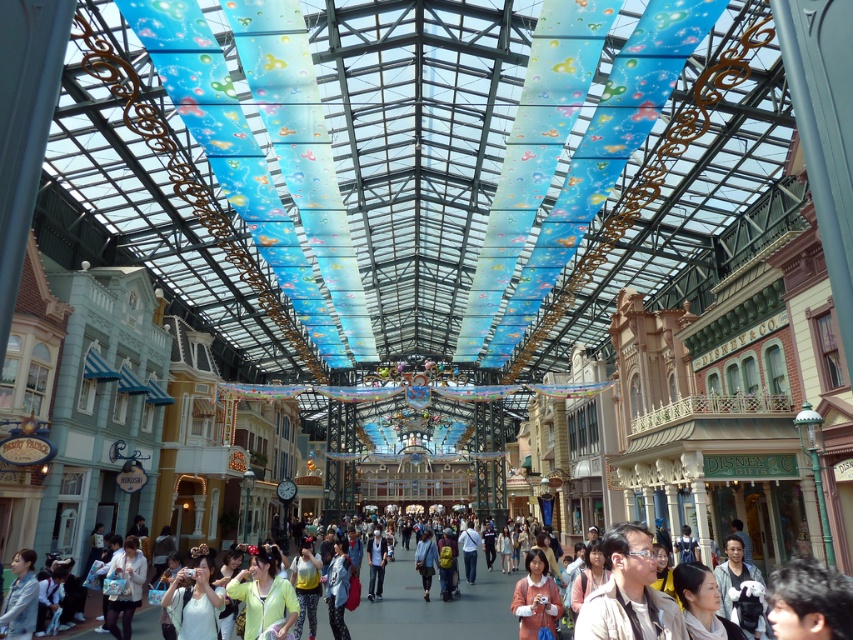
Question: Can you confirm if light green fabric at center is smaller than matte purple shirt at lower right?

Choices:
 (A) yes
 (B) no

Answer: (B)

Question: Which of the following is the closest to the observer?

Choices:
 (A) light green fabric at center
 (B) light brown leather jacket at lower right

Answer: (A)

Question: Which of these objects is positioned closest to the light green fabric at center?

Choices:
 (A) light blue denim jeans at center
 (B) matte purple shirt at lower right
 (C) denim jacket at lower left

Answer: (A)

Question: Does matte purple shirt at lower right have a lesser width compared to light blue denim jeans at center?

Choices:
 (A) no
 (B) yes

Answer: (B)

Question: Does light brown leather jacket at lower right come in front of light blue denim jeans at center?

Choices:
 (A) yes
 (B) no

Answer: (A)

Question: Which object appears farthest from the camera in this image?

Choices:
 (A) light brown leather jacket at lower right
 (B) light green fabric at center
 (C) matte purple shirt at lower right
 (D) denim jacket at lower left

Answer: (D)